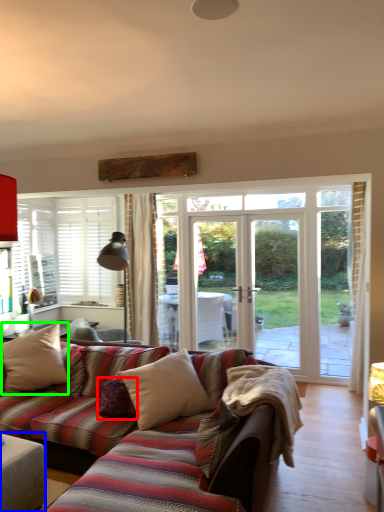
Question: Estimate the real-world distances between objects in this image. Which object is closer to pillow (highlighted by a red box), table (highlighted by a blue box) or pillow (highlighted by a green box)?

Choices:
 (A) table
 (B) pillow

Answer: (A)